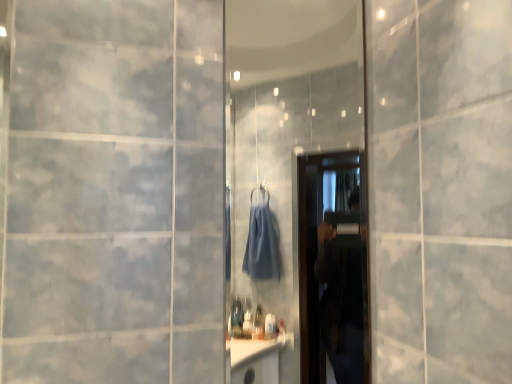
Identify the location of transparent glass mirror at center. (287, 125).

Describe the element at coordinates (287, 125) in the screenshot. I see `transparent glass mirror at center` at that location.

This screenshot has height=384, width=512. I want to click on transparent glass mirror at center, so click(287, 125).